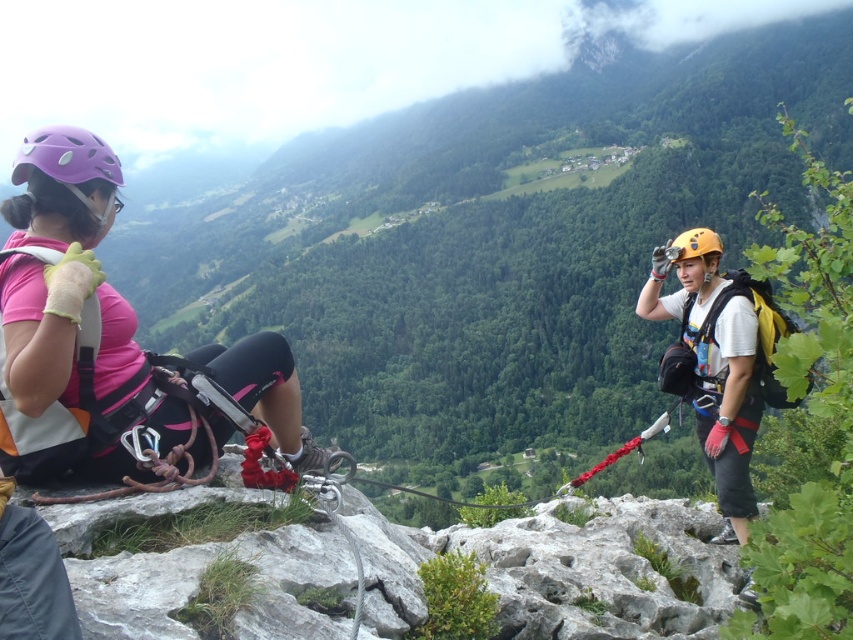
Question: Does yellow matte helmet at right appear over purple matte helmet at left?

Choices:
 (A) no
 (B) yes

Answer: (A)

Question: Which point is closer to the camera?

Choices:
 (A) (700, 228)
 (B) (22, 152)

Answer: (B)

Question: Is the position of yellow matte helmet at right more distant than that of purple matte helmet at left?

Choices:
 (A) no
 (B) yes

Answer: (B)

Question: Is yellow matte helmet at right positioned behind purple matte helmet at left?

Choices:
 (A) yes
 (B) no

Answer: (A)

Question: Among these points, which one is nearest to the camera?

Choices:
 (A) (25, 147)
 (B) (738, 589)

Answer: (A)

Question: Among these points, which one is farthest from the camera?

Choices:
 (A) (749, 320)
 (B) (111, 164)

Answer: (A)